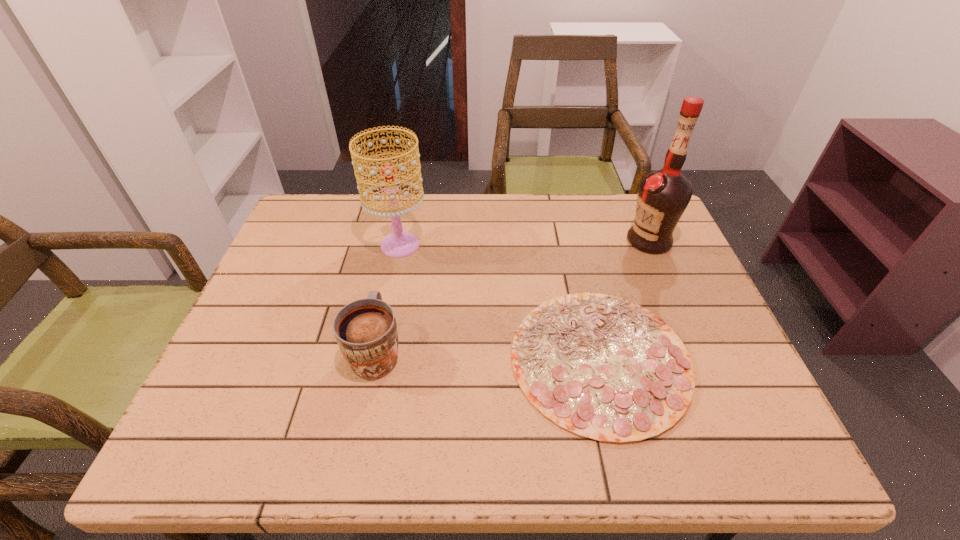
Where is `the tallest object`? Image resolution: width=960 pixels, height=540 pixels. the tallest object is located at coordinates (663, 195).

The width and height of the screenshot is (960, 540). I want to click on the second tallest object, so click(x=400, y=243).

Where is `mug`? Image resolution: width=960 pixels, height=540 pixels. mug is located at coordinates (366, 331).

You are a GUI agent. You are given a task and a screenshot of the screen. Output one action in this format:
    pyautogui.click(x=<x>, y=<y>)
    Task: Click on the pizza
    
    Given the screenshot: What is the action you would take?
    pyautogui.click(x=605, y=368)

Image resolution: width=960 pixels, height=540 pixels. What are the coordinates of `free space located on the front and back of the liquor` in the screenshot? It's located at (546, 240).

Image resolution: width=960 pixels, height=540 pixels. In order to click on vacant space situated on the front and back of the liquor in this screenshot , I will do `click(566, 240)`.

Find the location of a particular element. This screenshot has height=540, width=960. free spot located on the front and back of the liquor is located at coordinates (573, 240).

At what (x,y) coordinates should I click in order to perform the action: click on vacant point located 0.080m on the left of the third shortest object. Please return your answer as a coordinate pair (x, y). Looking at the image, I should click on (343, 245).

Locate an element on the screen. Image resolution: width=960 pixels, height=540 pixels. vacant space located on the side of the mug with the handle is located at coordinates (396, 259).

You are a GUI agent. You are given a task and a screenshot of the screen. Output one action in this format:
    pyautogui.click(x=<x>, y=<y>)
    Task: Click on the vacant space located on the side of the mug with the handle
    
    Given the screenshot: What is the action you would take?
    pyautogui.click(x=403, y=224)